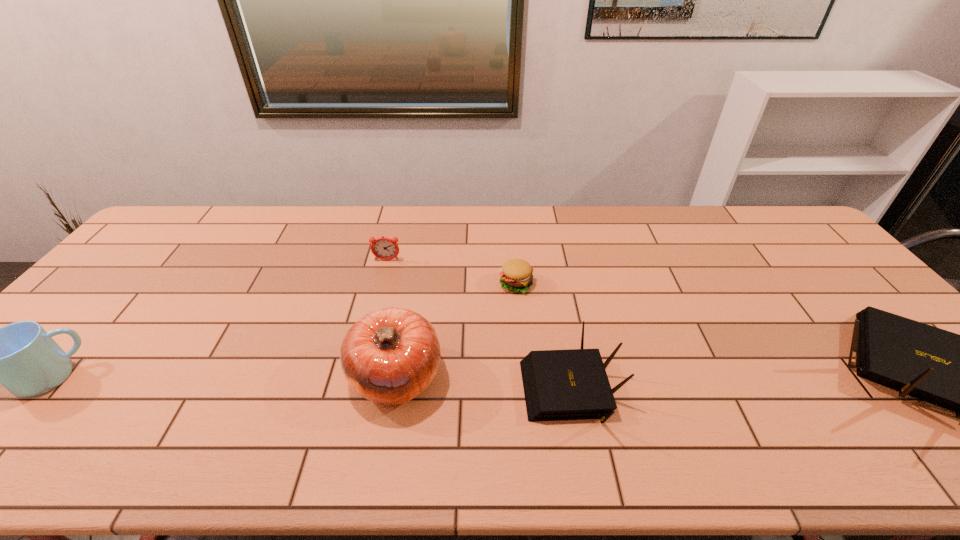
All routers are currently evenly spaced. To continue this pattern, where would you add another router on the left? Please point out a vacant spot. Please provide its 2D coordinates. Your answer should be formatted as a tuple, i.e. [(x, y)], where the tuple contains the x and y coordinates of a point satisfying the conditions above.

[(203, 409)]